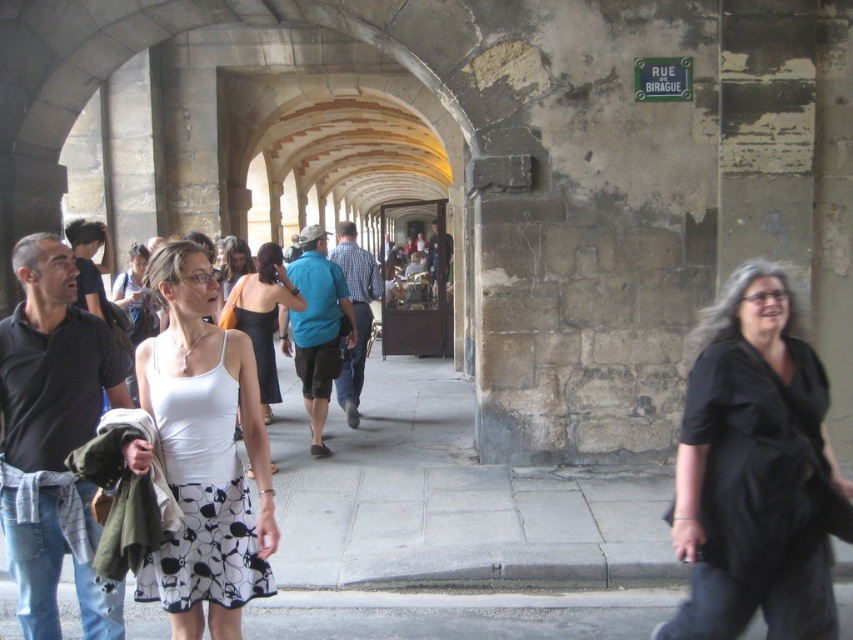
Question: In this image, where is black matte shirt at right located relative to white matte dress at center?

Choices:
 (A) below
 (B) above

Answer: (A)

Question: Which object appears closest to the camera in this image?

Choices:
 (A) white printed fabric dress at center
 (B) white matte dress at center
 (C) black matte shirt at right

Answer: (A)

Question: Can you confirm if black matte shirt at right is positioned above gray concrete pavement at lower center?

Choices:
 (A) no
 (B) yes

Answer: (B)

Question: Which of these objects is positioned closest to the gray concrete pavement at lower center?

Choices:
 (A) white matte dress at center
 (B) black matte shirt at right
 (C) white printed fabric dress at center

Answer: (B)

Question: Which of the following is the closest to the observer?

Choices:
 (A) white printed fabric dress at center
 (B) gray concrete pavement at lower center
 (C) white matte dress at center
 (D) black matte shirt at right

Answer: (A)

Question: Is white printed fabric dress at center positioned before gray concrete pavement at lower center?

Choices:
 (A) yes
 (B) no

Answer: (A)